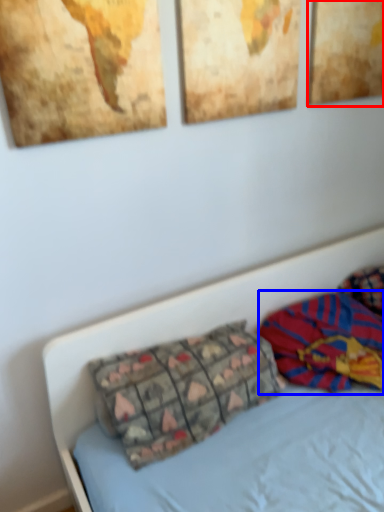
Question: Which of the following is the closest to the observer, picture frame (highlighted by a red box) or material (highlighted by a blue box)?

Choices:
 (A) picture frame
 (B) material

Answer: (B)